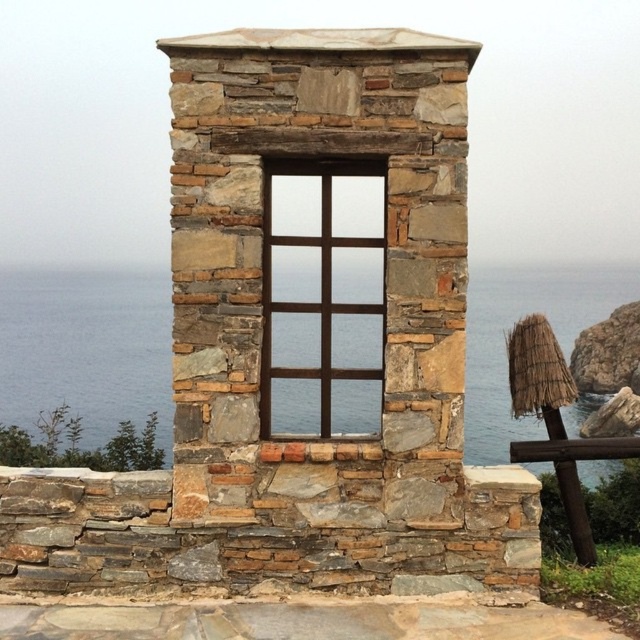
You are standing in front of the rustic stone structure and want to look through the brown wooden window at center. Is the transparent glass water at center blocking your view of the window?

The transparent glass water at center is located below the brown wooden window at center, so it is not blocking your view of the window.

You are an architect designing a model of this rustic stone structure. You need to place both the natural stone window at center and the brown wooden window at center. Which window should you make bigger in your model?

The natural stone window at center should be made bigger in the model since it is larger than the brown wooden window at center according to the description.